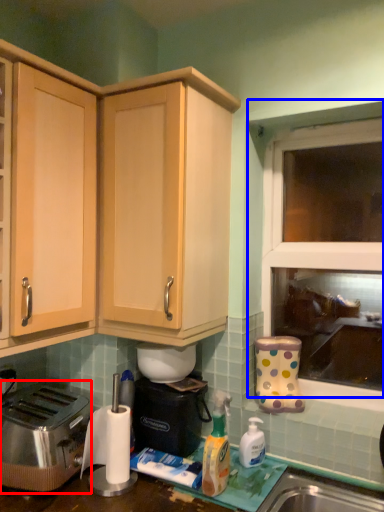
Question: Which object is closer to the camera taking this photo, toaster (highlighted by a red box) or window (highlighted by a blue box)?

Choices:
 (A) toaster
 (B) window

Answer: (A)